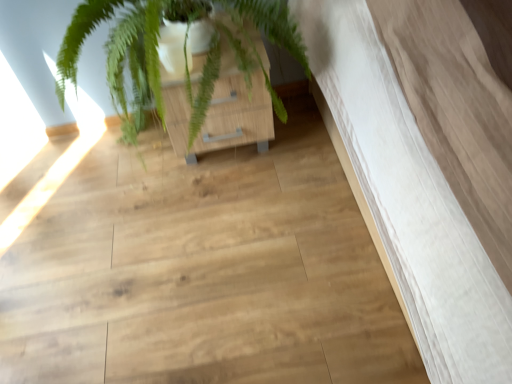
Where is `vacant position to the left of wooden cabinet at center`? This screenshot has height=384, width=512. vacant position to the left of wooden cabinet at center is located at coordinates (137, 168).